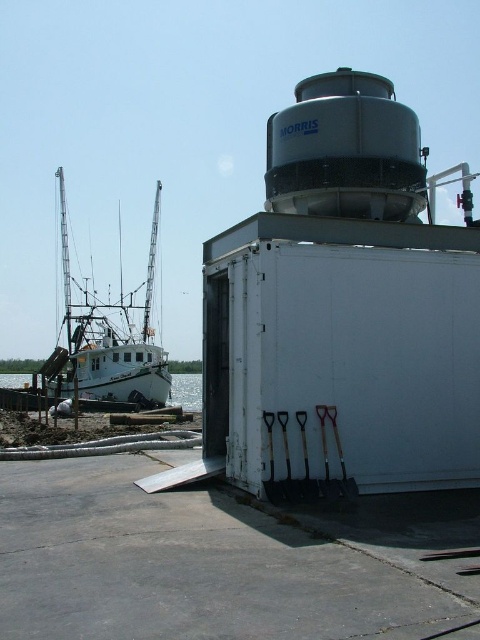
Question: Can you confirm if white matte boat at left is smaller than white glossy water at lower left?

Choices:
 (A) yes
 (B) no

Answer: (B)

Question: Which of the following is the closest to the observer?

Choices:
 (A) (189, 372)
 (B) (103, 397)

Answer: (B)

Question: Can you confirm if white matte boat at left is positioned to the right of white glossy water at lower left?

Choices:
 (A) yes
 (B) no

Answer: (B)

Question: Can you confirm if white matte boat at left is positioned to the left of white glossy water at lower left?

Choices:
 (A) no
 (B) yes

Answer: (B)